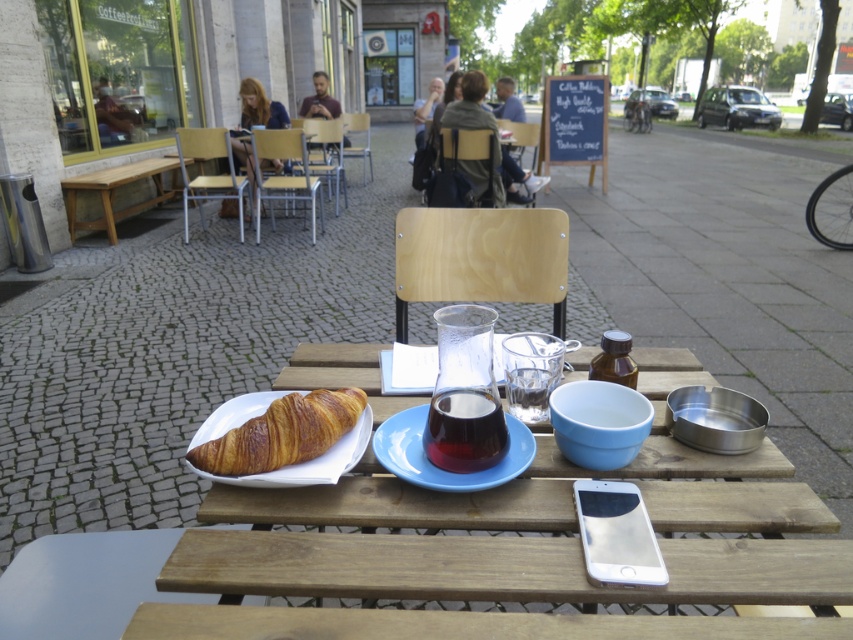
Question: Does wooden picnic table at center have a larger size compared to translucent glass beverage at center?

Choices:
 (A) yes
 (B) no

Answer: (A)

Question: Which object is closer to the camera taking this photo?

Choices:
 (A) light brown wooden bench at left
 (B) golden brown flaky croissant at lower left

Answer: (B)

Question: Can you confirm if blue matte plate at center is smaller than translucent glass beverage at center?

Choices:
 (A) no
 (B) yes

Answer: (A)

Question: Which object is farther from the camera taking this photo?

Choices:
 (A) wooden picnic table at center
 (B) golden brown flaky croissant at lower left
 (C) translucent glass beverage at center
 (D) light brown wooden bench at left

Answer: (D)

Question: Can you confirm if wooden picnic table at center is positioned to the right of blue matte plate at center?

Choices:
 (A) no
 (B) yes

Answer: (B)

Question: Which of these objects is positioned closest to the wooden picnic table at center?

Choices:
 (A) blue matte plate at center
 (B) translucent glass beverage at center

Answer: (A)